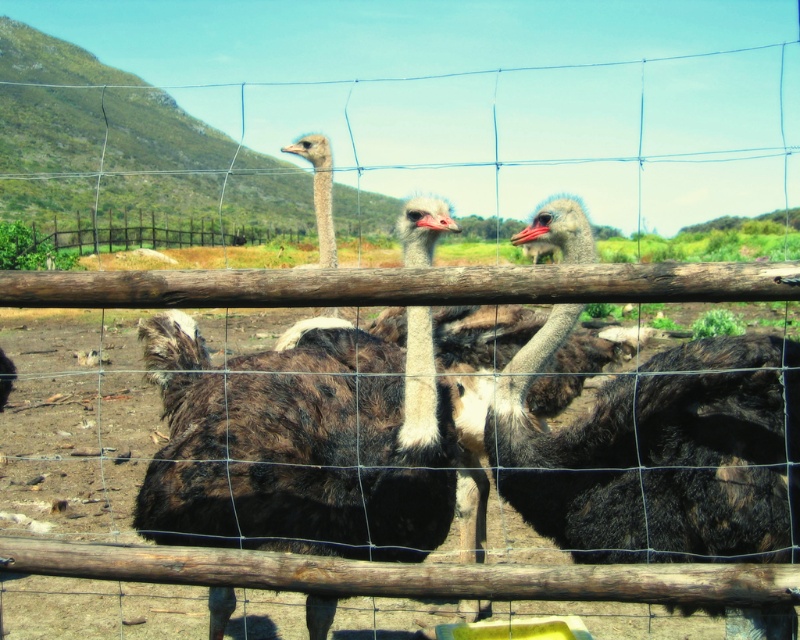
Who is more distant from viewer, (374, 406) or (728, 381)?

The point (374, 406) is behind.

Can you confirm if dark brown feathered ostrich at center is shorter than dark brown feathers at center?

No.

At what (x,y) coordinates should I click in order to perform the action: click on dark brown feathered ostrich at center. Please return your answer as a coordinate pair (x, y). Image resolution: width=800 pixels, height=640 pixels. Looking at the image, I should click on (306, 456).